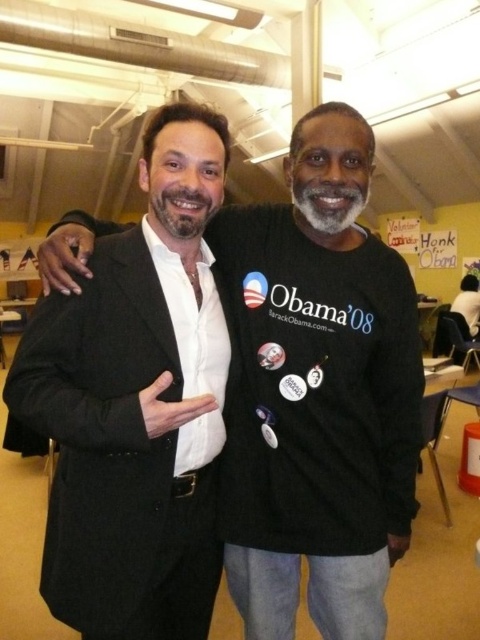
You are organizing a photo shoot and need to arrange two suits in a display case. The display case has a width of 1.2 meters. The matte black suit at center and the black matte suit at left are the two suits you have. Based on their widths, can both suits fit side by side in the display case without overlapping?

The matte black suit at center might be wider than black matte suit at left. Since the exact widths are not provided, it is uncertain if both can fit side by side in the 1.2 meters display case. Further measurements are needed to confirm.